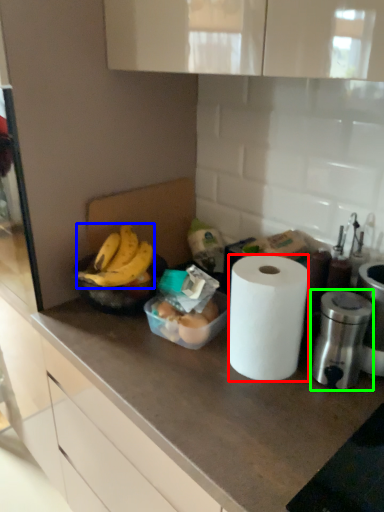
Question: Which object is positioned farthest from paper towel (highlighted by a red box)? Select from banana (highlighted by a blue box) and appliance (highlighted by a green box).

Choices:
 (A) banana
 (B) appliance

Answer: (A)